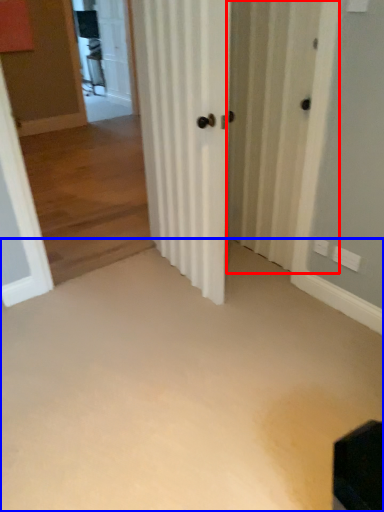
Question: Among these objects, which one is nearest to the camera, screen door (highlighted by a red box) or corridor (highlighted by a blue box)?

Choices:
 (A) screen door
 (B) corridor

Answer: (B)